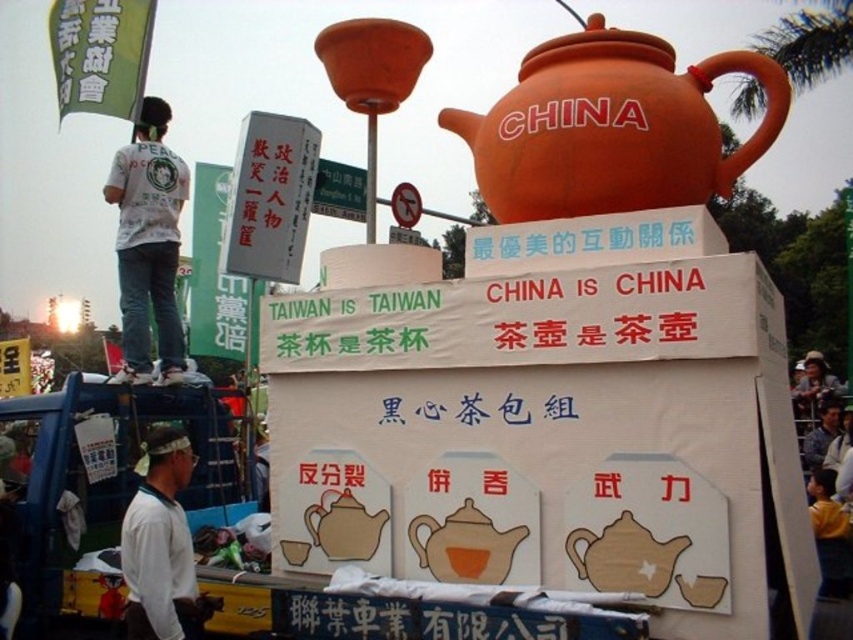
You are an event organizer who needs to ensure that two matte teapots on the float are spaced correctly for a photo shoot. The photographer requires that the distance between the two teapots must be exactly 8 feet to fit within the frame. Given the current setup, will the matte orange teapot at center and the matte brown teapot at center meet this requirement?

The matte orange teapot at center and the matte brown teapot at center are currently 8.15 feet apart from each other. Since the required distance is exactly 8 feet, the current spacing is slightly over the requirement by 0.15 feet. Therefore, the teapots do not meet the photographer

You are a drone operator trying to capture a photo of the float from above. The point at (430, 547) is part of the float. If you want to frame both the main teapot and the smaller sign in your shot, what is the minimum distance your drone needs to maintain from the float to ensure both are fully visible?

The minimum distance the drone needs to maintain is 23.21 meters to ensure both the main teapot and the smaller sign at point 0.851, 0.505 are fully visible.

You are a photographer at the event and want to capture both the matte orange clay teapot at upper center and the matte orange teapot at center in a single frame. Which teapot should you focus on first to ensure both are in the shot?

The matte orange clay teapot at upper center is located above the matte orange teapot at center, so focusing on the lower one first would allow you to frame both in the shot.